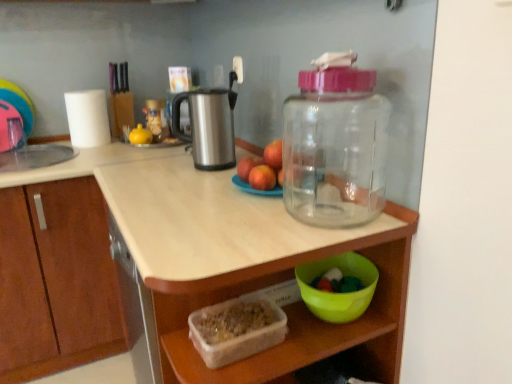
This screenshot has height=384, width=512. Identify the location of vacant space situated on the left part of brushed metal electric kettle at upper center. (162, 166).